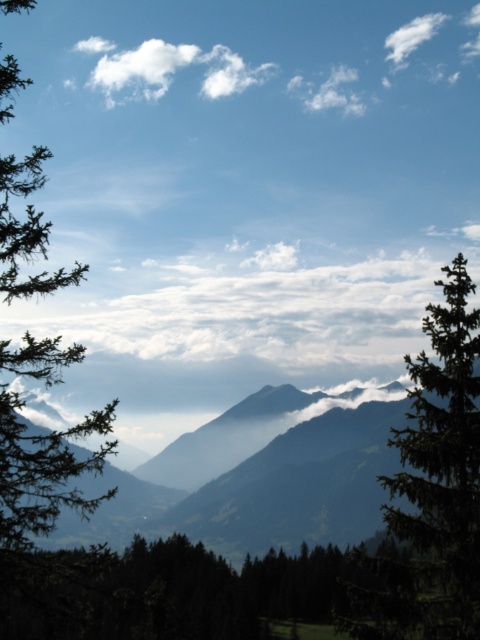
Question: Which of the following is the farthest from the observer?

Choices:
 (A) green matte tree at left
 (B) green textured tree at right
 (C) dark green textured mountain range at center
 (D) white fluffy cloud at upper right

Answer: (D)

Question: Estimate the real-world distances between objects in this image. Which object is farther from the green textured tree at right?

Choices:
 (A) white fluffy cloud at upper left
 (B) green matte tree at left
 (C) white fluffy cloud at upper right
 (D) dark green textured mountain range at center

Answer: (C)

Question: Is green matte tree at left further to camera compared to white fluffy cloud at upper left?

Choices:
 (A) no
 (B) yes

Answer: (A)

Question: Observing the image, what is the correct spatial positioning of dark green textured mountain range at center in reference to white fluffy cloud at upper right?

Choices:
 (A) above
 (B) below

Answer: (B)

Question: Which point is closer to the camera taking this photo?

Choices:
 (A) (373, 588)
 (B) (80, 529)

Answer: (A)

Question: From the image, what is the correct spatial relationship of green textured tree at right in relation to green matte tree at left?

Choices:
 (A) below
 (B) above

Answer: (A)